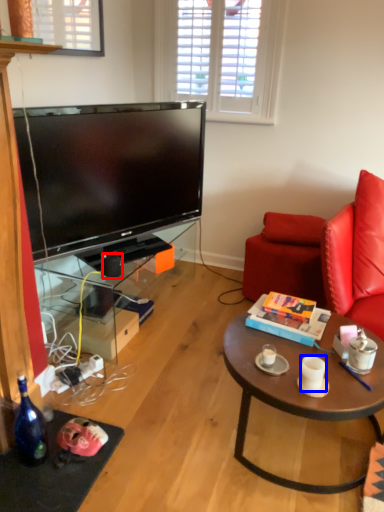
Question: Which object appears closest to the camera in this image, speaker (highlighted by a red box) or coffee cup (highlighted by a blue box)?

Choices:
 (A) speaker
 (B) coffee cup

Answer: (B)